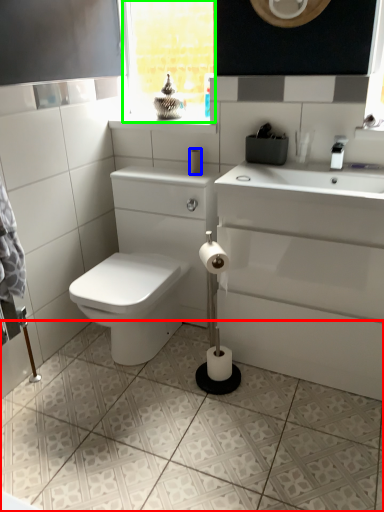
Question: Considering the real-world distances, which object is closest to ceramic tile (highlighted by a red box)? toilet paper (highlighted by a blue box) or window frame (highlighted by a green box).

Choices:
 (A) toilet paper
 (B) window frame

Answer: (A)